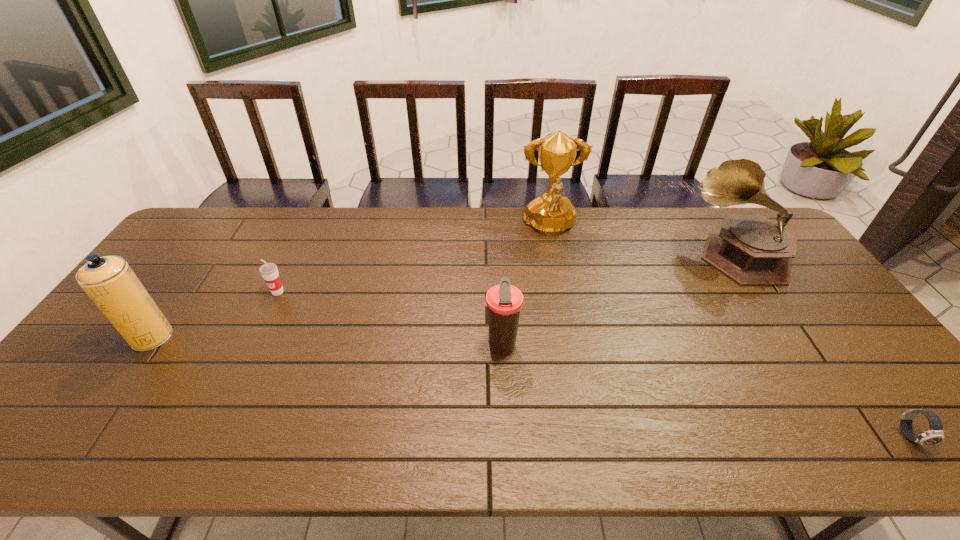
This screenshot has height=540, width=960. In order to click on the fourth object from left to right in this screenshot , I will do `click(550, 214)`.

I want to click on phonograph record, so click(750, 249).

Where is `the leftmost object`? This screenshot has height=540, width=960. the leftmost object is located at coordinates (109, 281).

I want to click on the fourth object from right to left, so click(x=504, y=301).

Where is `thermos bottle`? thermos bottle is located at coordinates (504, 301).

Where is `the fifth tallest object`? the fifth tallest object is located at coordinates (269, 271).

This screenshot has width=960, height=540. Find the location of `cup`. cup is located at coordinates 269,271.

What are the coordinates of `watch` in the screenshot? It's located at (934, 435).

Locate an element on the screen. The height and width of the screenshot is (540, 960). the shortest object is located at coordinates (934, 435).

You are a GUI agent. You are given a task and a screenshot of the screen. Output one action in this format:
    pyautogui.click(x=<x>, y=<y>)
    Task: Click on the vacant space located on the front side of the award
    
    Given the screenshot: What is the action you would take?
    pyautogui.click(x=559, y=274)